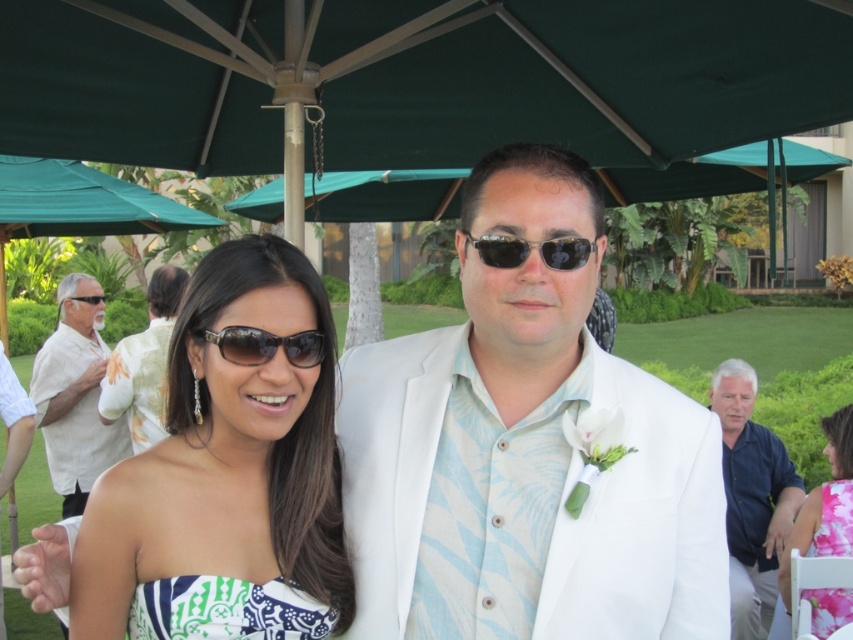
Question: Among these objects, which one is farthest from the camera?

Choices:
 (A) matte black sunglasses at center
 (B) black plastic sunglasses at center

Answer: (A)

Question: Can you confirm if dark blue shirt at right is thinner than black plastic sunglasses at upper center?

Choices:
 (A) no
 (B) yes

Answer: (A)

Question: Does white fabric suit at center appear under white printed dress at center?

Choices:
 (A) yes
 (B) no

Answer: (B)

Question: Which point appears farthest from the camera in this image?

Choices:
 (A) (822, 625)
 (B) (730, 424)
 (C) (445, 132)

Answer: (B)

Question: Is pink floral dress at lower right positioned in front of black plastic sunglasses at center?

Choices:
 (A) yes
 (B) no

Answer: (B)

Question: Which point is farther from the camera taking this photo?

Choices:
 (A) (267, 342)
 (B) (93, 301)

Answer: (B)